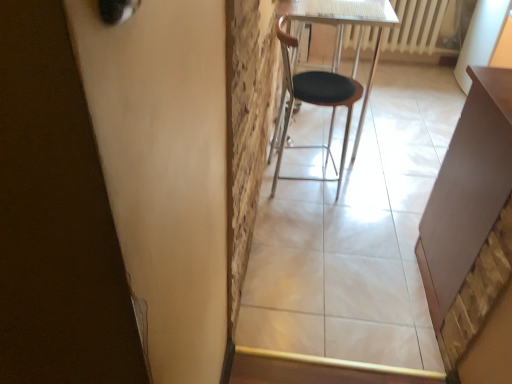
The image size is (512, 384). Identify the location of vacant area located to the right-hand side of black leather chair at center. (387, 180).